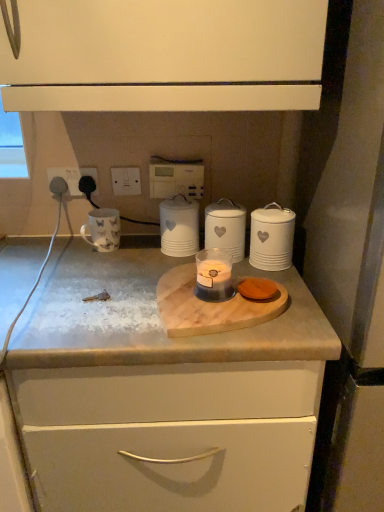
Locate an element on the screen. This screenshot has height=512, width=384. free space to the left of white glossy mug at left is located at coordinates (69, 250).